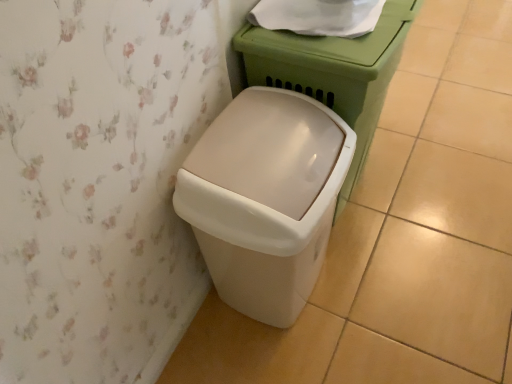
Locate an element on the screen. The height and width of the screenshot is (384, 512). free space above beige plastic waste container at lower left (from a real-world perspective) is located at coordinates (x=294, y=161).